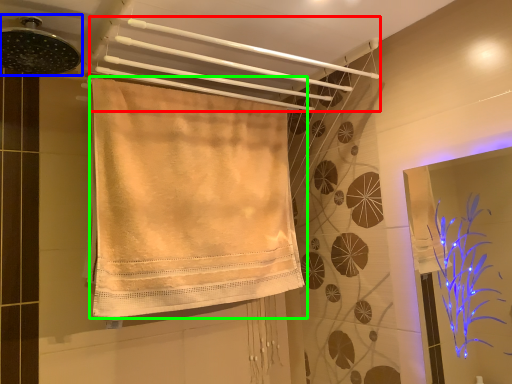
Question: Which object is the closest to the towel (highlighted by a red box)? Choose among these: shower (highlighted by a blue box) or towel (highlighted by a green box).

Choices:
 (A) shower
 (B) towel

Answer: (B)